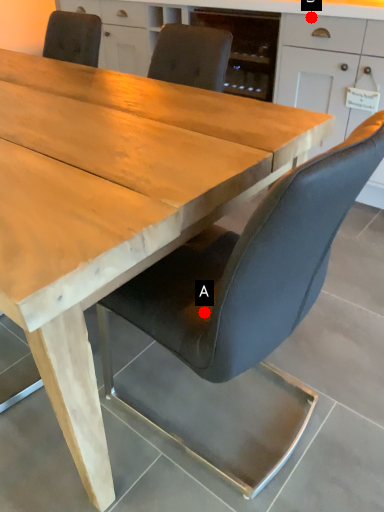
Question: Two points are circled on the image, labeled by A and B beside each circle. Which of the following is the closest to the observer?

Choices:
 (A) A is closer
 (B) B is closer

Answer: (A)